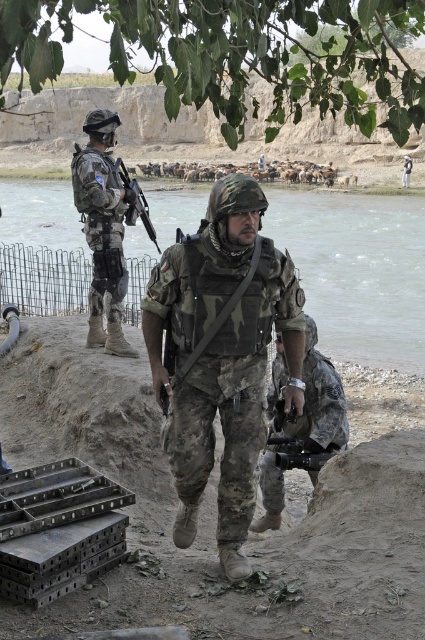
Looking at the two soldiers in the military scene, where is the camouflage fabric helmet at center in relation to the camouflage uniform at center?

The camouflage fabric helmet at center is to the left of the camouflage uniform at center.

Consider the image. You are a soldier in the military scene near the riverbank. You need to cross the river quickly. Where is the clear water at river right located?

The clear water at river right is located at point (357, 269), which is the coordinate position in the image.